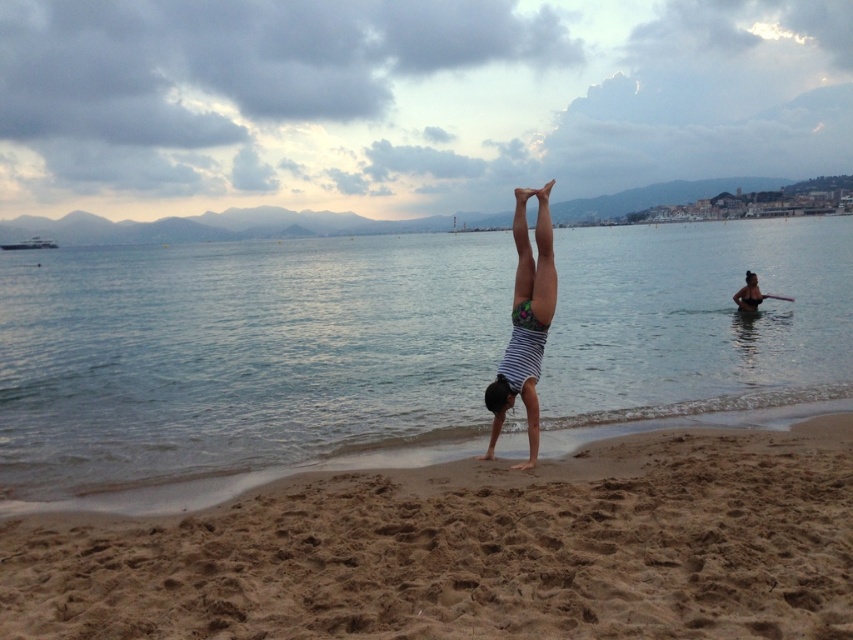
Question: Which of the following is the farthest from the observer?

Choices:
 (A) (531, 323)
 (B) (465, 476)
 (C) (262, 397)

Answer: (C)

Question: Is clear blue water at center below brown sandy beach at center?

Choices:
 (A) no
 (B) yes

Answer: (A)

Question: From the image, what is the correct spatial relationship of clear blue water at center in relation to brown sandy beach at center?

Choices:
 (A) below
 (B) above

Answer: (B)

Question: Which of the following is the farthest from the observer?

Choices:
 (A) brown sandy beach at center
 (B) clear blue water at center
 (C) striped fabric person at center

Answer: (C)

Question: In this image, where is clear blue water at center located relative to brown sandy beach at center?

Choices:
 (A) above
 (B) below

Answer: (A)

Question: Which of the following is the closest to the observer?

Choices:
 (A) clear blue water at center
 (B) brown sandy beach at center

Answer: (B)